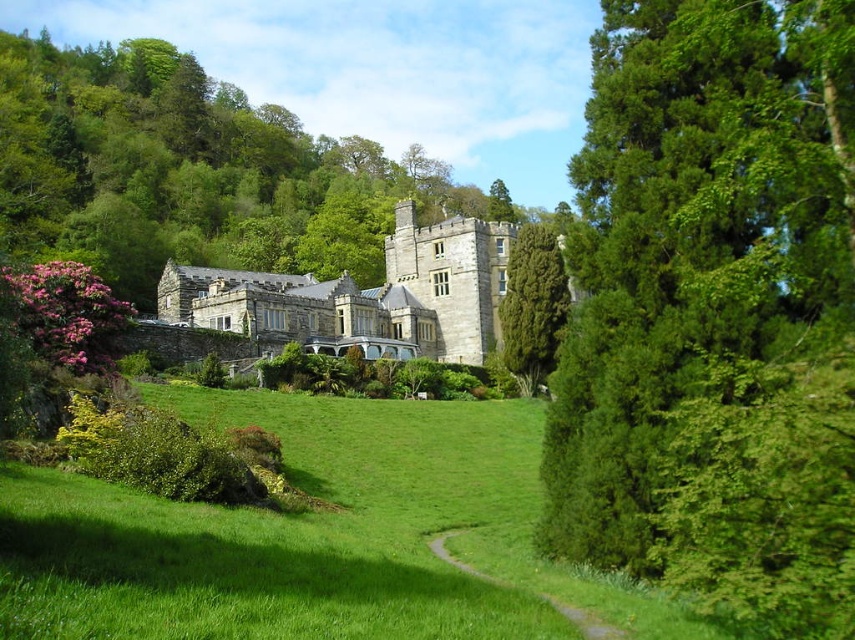
Question: Estimate the real-world distances between objects in this image. Which object is farther from the stone mansion at center?

Choices:
 (A) green leafy tree at center
 (B) green textured tree at center right
 (C) green leafy tree at right

Answer: (A)

Question: Among these points, which one is nearest to the camera?

Choices:
 (A) tap(156, 70)
 (B) tap(78, 509)
 (C) tap(493, 304)
 (D) tap(770, 193)

Answer: (D)

Question: In this image, where is green leafy tree at right located relative to stone mansion at center?

Choices:
 (A) below
 (B) above

Answer: (A)

Question: Is pink matte rhododendron at lower left above green textured tree at center right?

Choices:
 (A) yes
 (B) no

Answer: (B)

Question: Estimate the real-world distances between objects in this image. Which object is closer to the stone mansion at center?

Choices:
 (A) pink matte rhododendron at lower left
 (B) green grassy at center

Answer: (A)

Question: Can you confirm if green leafy tree at center is wider than stone mansion at center?

Choices:
 (A) no
 (B) yes

Answer: (B)